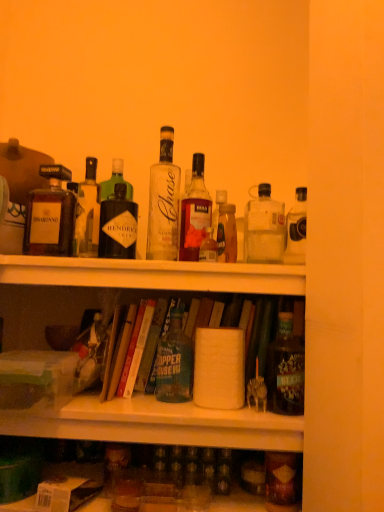
Locate an element on the screen. This screenshot has height=512, width=384. free point in front of green matte bottle at center, which is counted as the 4th bottle, starting from the left is located at coordinates (176, 406).